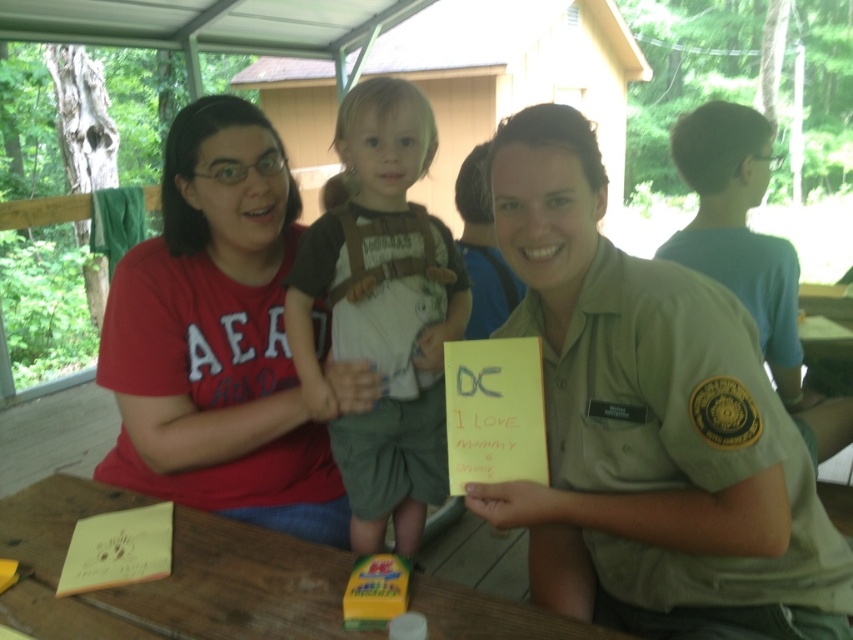
You are organizing a clothing donation drive and need to determine which item takes up more space in the storage container. Based on the image, which of the two shirts, the brown cotton shirt at center or the blue cotton shirt at upper right, should be placed first to optimize space?

The blue cotton shirt at upper right occupies more space than the brown cotton shirt at center, so it should be placed first to optimize space in the storage container.

You are organizing a clothing donation drive and need to categorize shirts based on their sizes. You have two shirts in front of you, the brown cotton shirt at center and the blue cotton shirt at upper right. Which shirt has a smaller width and should be placed in the small size bin?

The brown cotton shirt at center has a smaller width than the blue cotton shirt at upper right, so it should be placed in the small size bin.

You are standing at the position of point (459, 262) and want to walk towards point (119, 408). Which direction should you move relative to your current position?

You should move forward because point (119, 408) is in front of point (459, 262) from your current position.